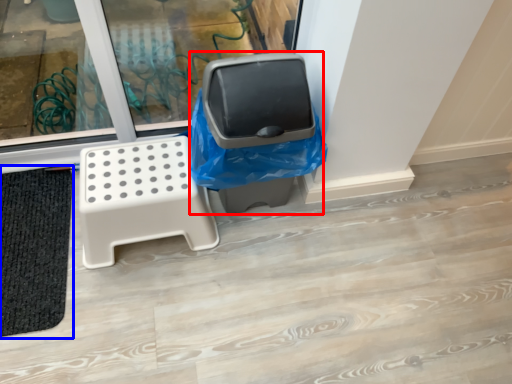
Question: Which object is closer to the camera taking this photo, garbage (highlighted by a red box) or bath mat (highlighted by a blue box)?

Choices:
 (A) garbage
 (B) bath mat

Answer: (A)